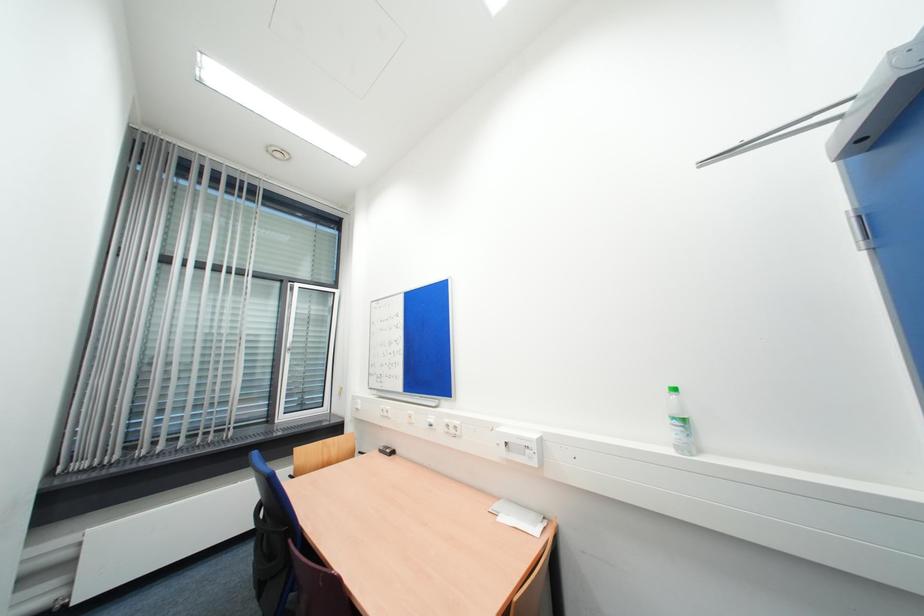
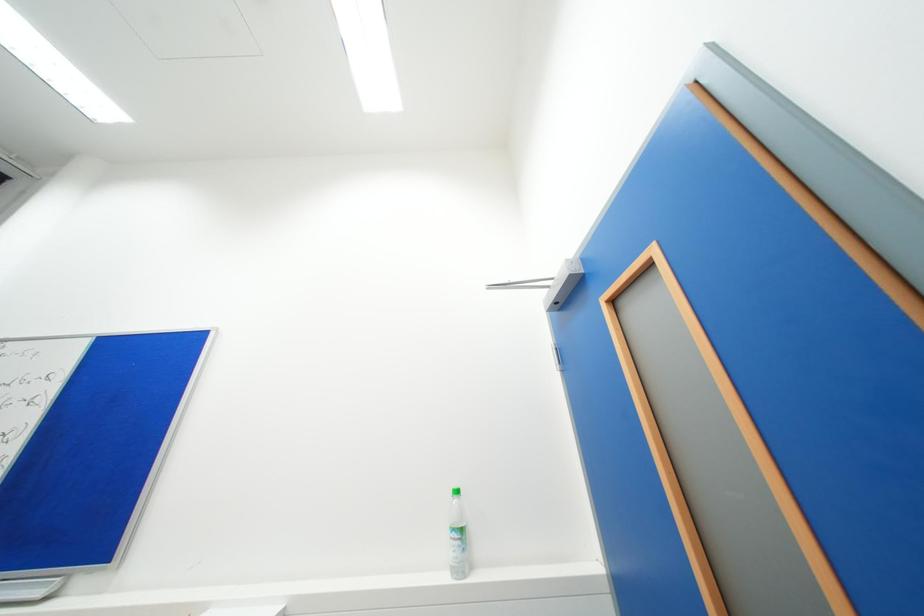
The images are taken continuously from a first-person perspective. In which direction is your viewpoint rotating?

The rotation direction of the camera is right-up.